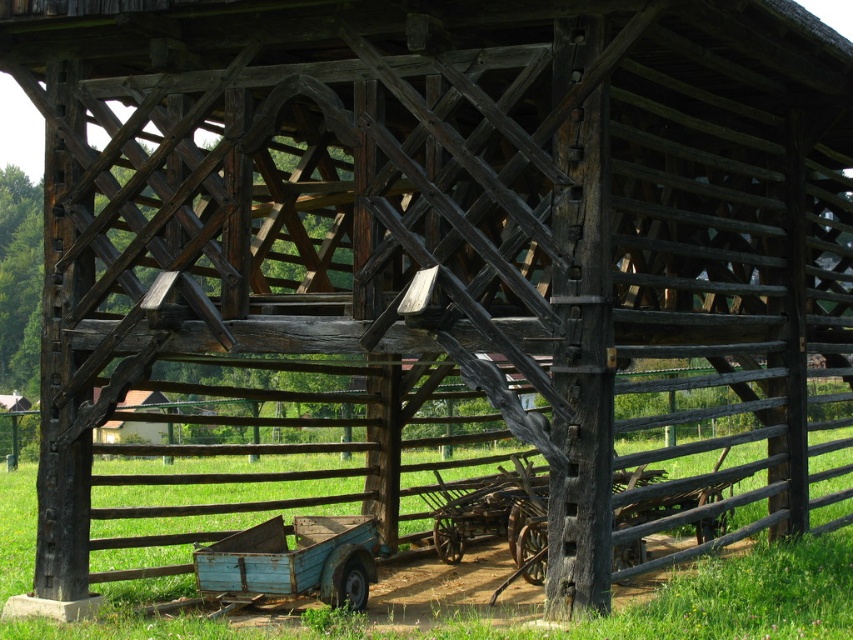
You are a farmer who needs to move the rusty wooden wagon at lower center and the brown wooden fence at center to a new location. Based on their sizes, which object would require more space when transporting?

The brown wooden fence at center is larger than the rusty wooden wagon at lower center, so it would require more space when transporting.

You are standing in front of the rustic wooden structure and want to move your equipment from the rusty wooden wagon at lower center to the brown wooden fence at center. In which direction should you move the equipment?

You should move the equipment to the right, as the rusty wooden wagon at lower center is located to the left of the brown wooden fence at center.